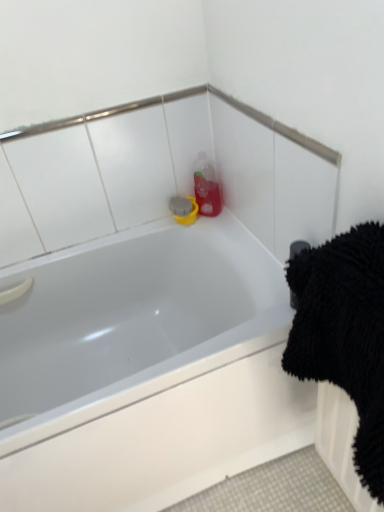
Image resolution: width=384 pixels, height=512 pixels. In order to click on vacant area to the left of black rubber towel bar at upper right in this screenshot , I will do `click(259, 320)`.